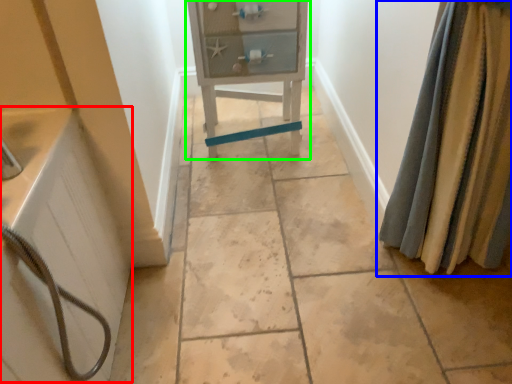
Question: Which object is the closest to the bath (highlighted by a red box)? Choose among these: curtain (highlighted by a blue box) or furniture (highlighted by a green box).

Choices:
 (A) curtain
 (B) furniture

Answer: (B)